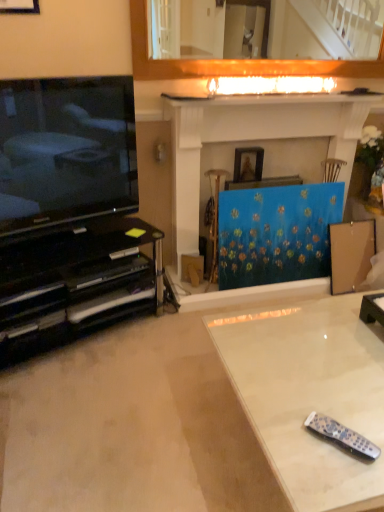
Question: From a real-world perspective, relative to wooden picture frame at center, arranged as the 1th picture frame when ordered from the bottom, is white glossy mantle at upper center vertically above or below?

Choices:
 (A) above
 (B) below

Answer: (A)

Question: Is white glossy mantle at upper center to the left or to the right of wooden picture frame at center, arranged as the second picture frame when viewed from the front, in the image?

Choices:
 (A) right
 (B) left

Answer: (A)

Question: Estimate the real-world distances between objects in this image. Which object is farther from the blue textured fabric at center?

Choices:
 (A) black glass tv stand at lower left
 (B) white glossy mantle at upper center
 (C) wooden picture frame at upper left, acting as the 2th picture frame starting from the back
 (D) brown cardboard box at center
 (E) wooden picture frame at center, acting as the 2th picture frame starting from the top

Answer: (C)

Question: Considering the real-world distances, which object is closest to the black plastic remote at lower right?

Choices:
 (A) white glossy table at lower right
 (B) white glossy mantle at upper center
 (C) matte black television at left
 (D) blue canvas painting at center
 (E) wooden picture frame at center, arranged as the second picture frame when viewed from the front

Answer: (A)